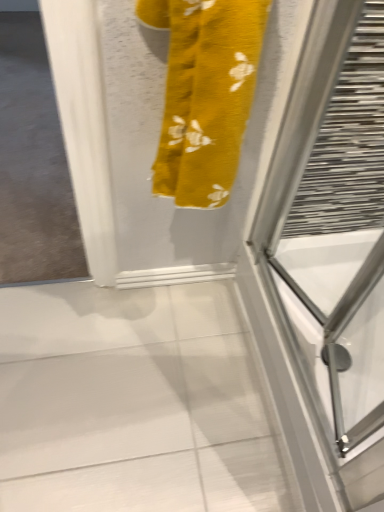
Question: Looking at the image, does transparent glass screen door at right seem bigger or smaller compared to yellow fabric towel at upper center?

Choices:
 (A) small
 (B) big

Answer: (B)

Question: From a real-world perspective, relative to yellow fabric towel at upper center, is transparent glass screen door at right vertically above or below?

Choices:
 (A) below
 (B) above

Answer: (A)

Question: Considering the positions of point (375, 455) and point (153, 15), is point (375, 455) closer or farther from the camera than point (153, 15)?

Choices:
 (A) closer
 (B) farther

Answer: (B)

Question: Looking at their shapes, would you say yellow fabric towel at upper center is wider or thinner than transparent glass screen door at right?

Choices:
 (A) thin
 (B) wide

Answer: (A)

Question: From their relative heights in the image, would you say yellow fabric towel at upper center is taller or shorter than transparent glass screen door at right?

Choices:
 (A) short
 (B) tall

Answer: (B)

Question: Would you say yellow fabric towel at upper center is inside or outside transparent glass screen door at right?

Choices:
 (A) inside
 (B) outside

Answer: (B)

Question: Relative to transparent glass screen door at right, is yellow fabric towel at upper center in front or behind?

Choices:
 (A) front
 (B) behind

Answer: (A)